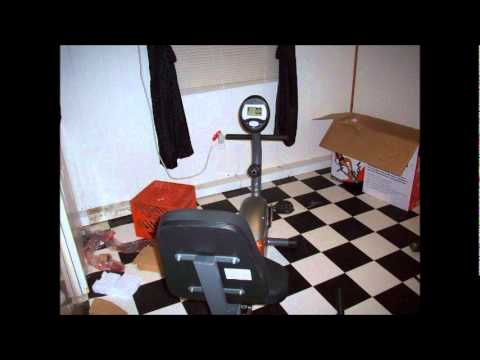
Where is `plastic milk crate`? plastic milk crate is located at coordinates point(156,205).